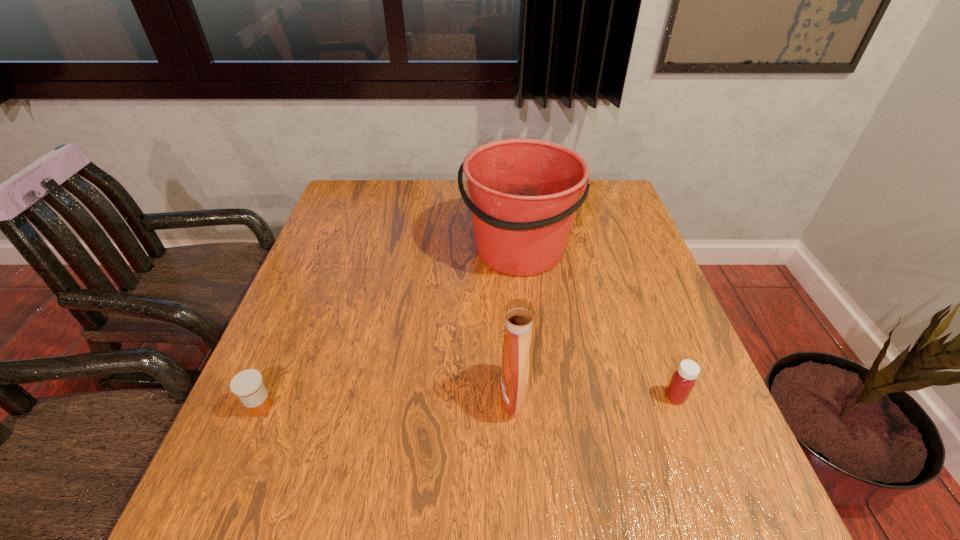
Identify the location of vacant area that lies between the farthest object and the right medicine. (596, 323).

The image size is (960, 540). In order to click on vacant space that is in between the bucket and the right medicine in this screenshot , I will do `click(596, 323)`.

Where is `vacant space that's between the rightmost object and the leftmost object`? Image resolution: width=960 pixels, height=540 pixels. vacant space that's between the rightmost object and the leftmost object is located at coordinates (468, 402).

In order to click on vacant area that lies between the detergent and the left medicine in this screenshot , I will do [387, 401].

You are a GUI agent. You are given a task and a screenshot of the screen. Output one action in this format:
    pyautogui.click(x=<x>, y=<y>)
    Task: Click on the vacant area that lies between the rightmost object and the left medicine
    
    Given the screenshot: What is the action you would take?
    pyautogui.click(x=468, y=402)

The image size is (960, 540). I want to click on vacant space that is in between the bucket and the rightmost object, so click(596, 323).

Where is `free space that is in between the rightmost object and the left medicine`? The width and height of the screenshot is (960, 540). free space that is in between the rightmost object and the left medicine is located at coordinates (468, 402).

Image resolution: width=960 pixels, height=540 pixels. Find the location of `empty space between the left medicine and the detergent`. empty space between the left medicine and the detergent is located at coordinates (387, 401).

The image size is (960, 540). In order to click on vacant region between the left medicine and the bucket in this screenshot , I will do `click(389, 328)`.

I want to click on the closest object to the rightmost object, so click(519, 316).